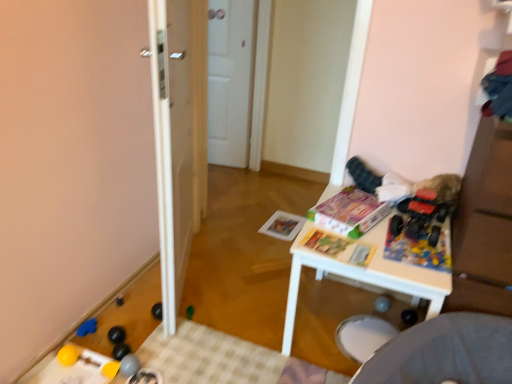
Find the location of a particular element. Image resolution: width=512 pixels, height=384 pixels. free region under matte paper magazine at center, which appears as the 3th magazine when viewed from the back (from a real-world perspective) is located at coordinates (338, 249).